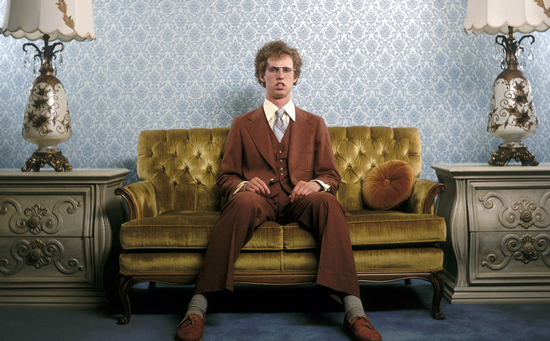
Locate an element on the screen. knob is located at coordinates [x=526, y=217].